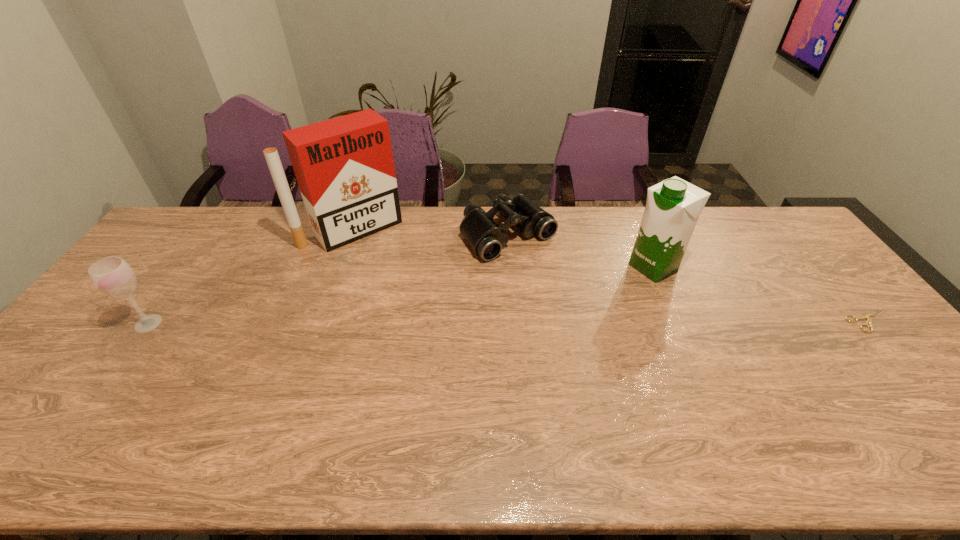
This screenshot has width=960, height=540. I want to click on free spot located on the back of the leftmost object, so click(x=198, y=255).

Where is `vacant position located on the left of the shears`? Image resolution: width=960 pixels, height=540 pixels. vacant position located on the left of the shears is located at coordinates (818, 321).

Image resolution: width=960 pixels, height=540 pixels. Find the location of `vacant space situated on the front-facing side of the binoculars`. vacant space situated on the front-facing side of the binoculars is located at coordinates (569, 293).

Locate an element on the screen. vacant space located 0.340m on the front-facing side of the binoculars is located at coordinates (608, 331).

Find the location of a particular element. This screenshot has height=540, width=960. free space located on the front-facing side of the binoculars is located at coordinates tap(612, 336).

Where is `vacant space located 0.360m on the front-facing side of the second object from right to left`? The width and height of the screenshot is (960, 540). vacant space located 0.360m on the front-facing side of the second object from right to left is located at coordinates (547, 328).

The height and width of the screenshot is (540, 960). I want to click on vacant space located on the front-facing side of the second object from right to left, so click(545, 330).

Image resolution: width=960 pixels, height=540 pixels. I want to click on vacant space located 0.200m on the front-facing side of the second object from right to left, so (x=589, y=304).

Where is `free space located on the front-facing side of the second object from left to right`? This screenshot has width=960, height=540. free space located on the front-facing side of the second object from left to right is located at coordinates (396, 268).

The width and height of the screenshot is (960, 540). In order to click on vacant space located on the front-facing side of the second object from left to right in this screenshot , I will do `click(441, 318)`.